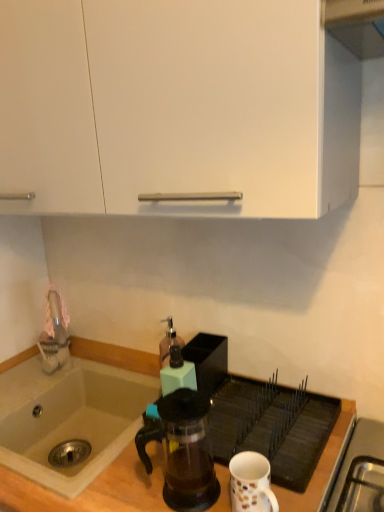
The image size is (384, 512). What are the coordinates of `unoccupied space behind transparent glass coffee maker at center` in the screenshot? It's located at (201, 436).